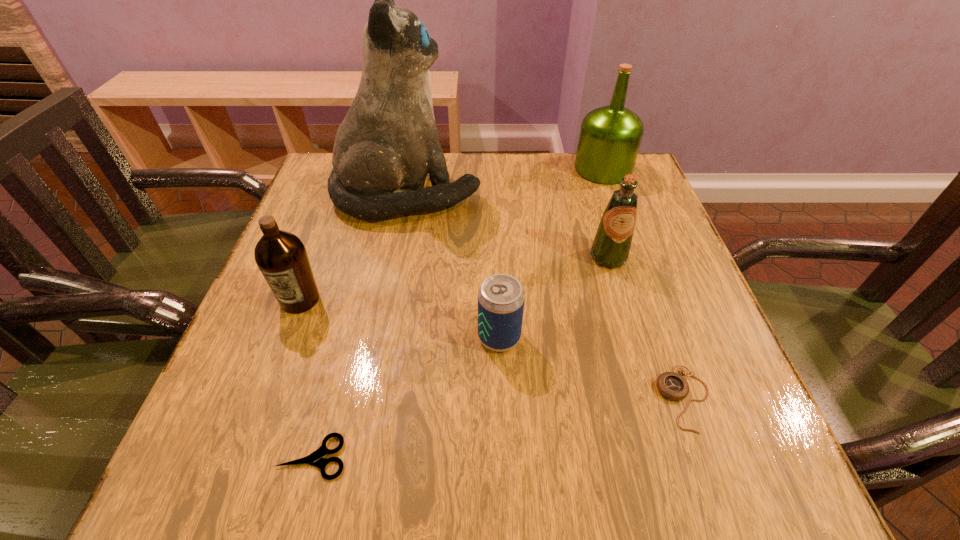
This screenshot has height=540, width=960. What are the coordinates of `object at the near right corner` in the screenshot? It's located at (673, 386).

Identify the location of free space at the far edge of the desktop. (564, 187).

In the image, there is a desktop. Identify the location of vacant space at the near edge. This screenshot has width=960, height=540. (470, 441).

This screenshot has height=540, width=960. What are the coordinates of `vacant space at the left edge of the desktop` in the screenshot? It's located at (286, 337).

Identify the location of free space at the right edge of the desktop. (672, 244).

The width and height of the screenshot is (960, 540). In the image, there is a desktop. Identify the location of vacant space at the near left corner. (258, 435).

Find the location of `free location at the near right corner`. free location at the near right corner is located at coordinates (717, 461).

You are a GUI agent. You are given a task and a screenshot of the screen. Output one action in this format:
    pyautogui.click(x=<x>, y=<y>)
    Task: Click on the free spot between the fourth nearest object and the cat
    Image resolution: width=960 pixels, height=540 pixels.
    Given the screenshot: What is the action you would take?
    pyautogui.click(x=353, y=247)

Where is `free space between the leftmost olive oil and the second nearest olive oil`? This screenshot has width=960, height=540. free space between the leftmost olive oil and the second nearest olive oil is located at coordinates (454, 278).

Find the location of a particular element. The height and width of the screenshot is (540, 960). vacant region between the fifth tallest object and the tallest object is located at coordinates (453, 266).